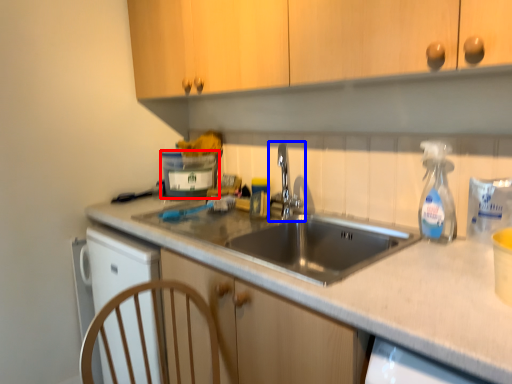
Question: Which object appears closest to the camera in this image, appliance (highlighted by a red box) or tap (highlighted by a blue box)?

Choices:
 (A) appliance
 (B) tap

Answer: (B)